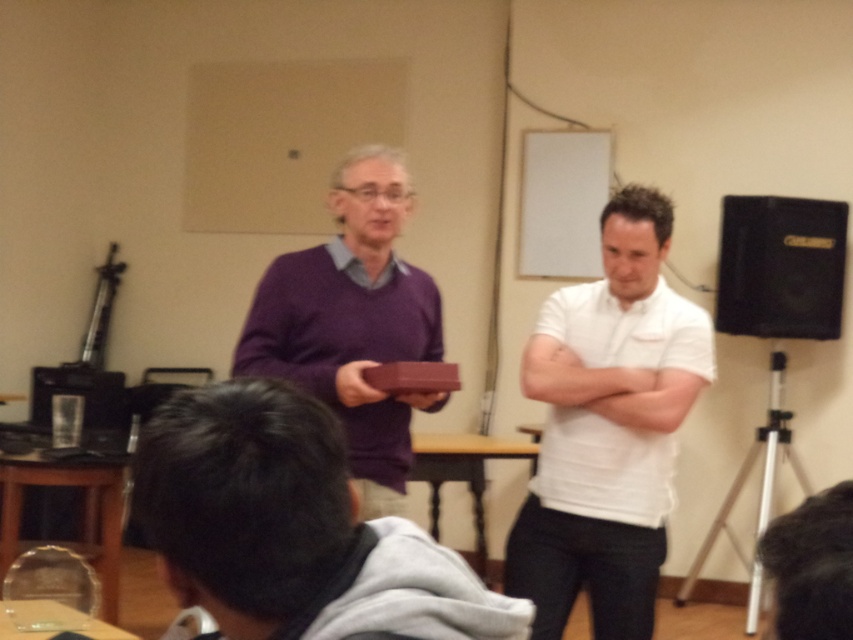
Where is the matte purple sweater at center located in the image?

The matte purple sweater at center is located at point coordinates of (293,529).

You are organizing a charity event and need to decide which item to place on a narrow shelf that can only hold items up to 5 cm in thickness. You have the matte purple sweater at center and the black leather speaker at right. Which item would you choose?

The matte purple sweater at center is thinner than the black leather speaker at right, so it would fit on the narrow shelf that can only hold items up to 5 cm in thickness.